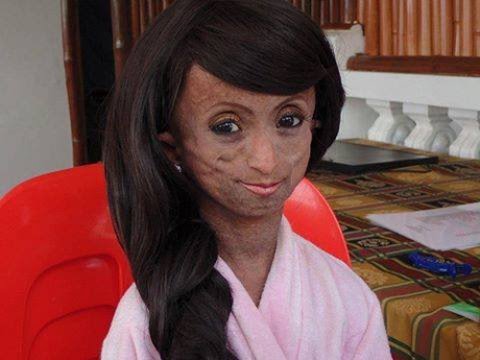
Find the location of a particular element. The height and width of the screenshot is (360, 480). 1 robe is located at coordinates (333, 298).